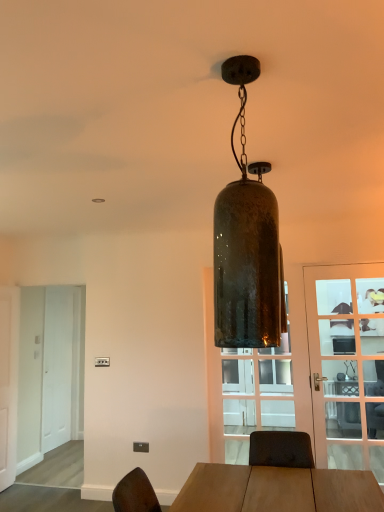
The width and height of the screenshot is (384, 512). I want to click on free space above green glass pendant light at center (from a real-world perspective), so click(253, 57).